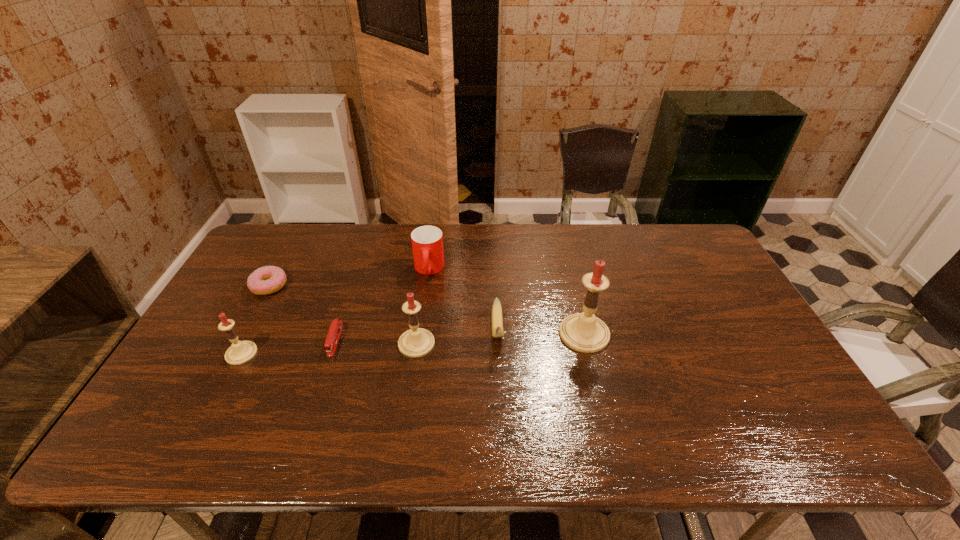
This screenshot has width=960, height=540. What are the coordinates of `free space located 0.140m on the right of the shortest candle` in the screenshot? It's located at (308, 354).

Where is `free point located 0.210m on the back of the second candle from right to left`? free point located 0.210m on the back of the second candle from right to left is located at coordinates (425, 281).

Locate an element on the screen. vacant space located on the left of the tallest candle is located at coordinates (456, 334).

Locate an element on the screen. This screenshot has width=960, height=540. free space located 0.310m on the side of the cup with the handle is located at coordinates (417, 362).

This screenshot has width=960, height=540. What are the coordinates of `vacant space located 0.090m on the front-facing side of the stapler` in the screenshot? It's located at (321, 385).

Identify the location of vacant space situated on the right of the doughnut. (335, 286).

Where is `free space located at the stem of the third shortest object`? free space located at the stem of the third shortest object is located at coordinates (499, 382).

The height and width of the screenshot is (540, 960). Find the location of `object that is at the far edge`. object that is at the far edge is located at coordinates (427, 241).

The height and width of the screenshot is (540, 960). I want to click on candle that is at the left edge, so click(x=240, y=352).

Where is `doughnut located at the left edge`? The image size is (960, 540). doughnut located at the left edge is located at coordinates (266, 280).